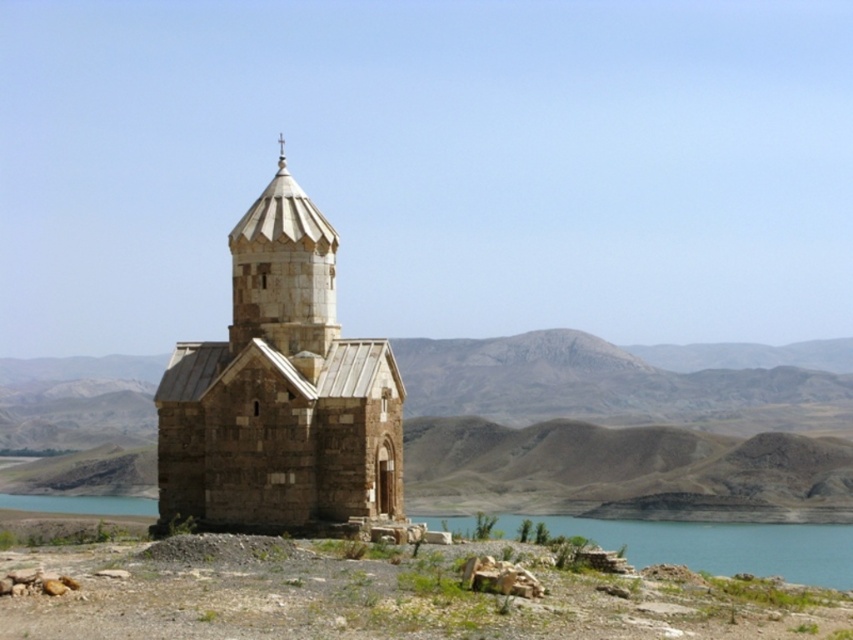
Question: Which of the following is the closest to the observer?

Choices:
 (A) (659, 529)
 (B) (386, 481)

Answer: (B)

Question: Does stone church at center appear on the left side of blue water at lower center?

Choices:
 (A) no
 (B) yes

Answer: (B)

Question: Which point is closer to the camera?

Choices:
 (A) stone church at center
 (B) blue water at lower center

Answer: (A)

Question: Does stone church at center have a larger size compared to blue water at lower center?

Choices:
 (A) no
 (B) yes

Answer: (A)

Question: Considering the relative positions of stone church at center and blue water at lower center in the image provided, where is stone church at center located with respect to blue water at lower center?

Choices:
 (A) right
 (B) left

Answer: (B)